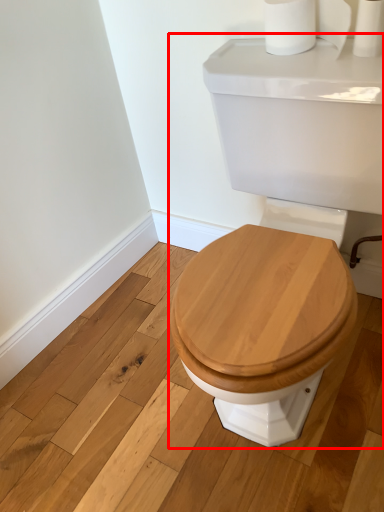
Question: Where is porcelain (annotated by the red box) located in relation to toilet paper in the image?

Choices:
 (A) right
 (B) left

Answer: (B)